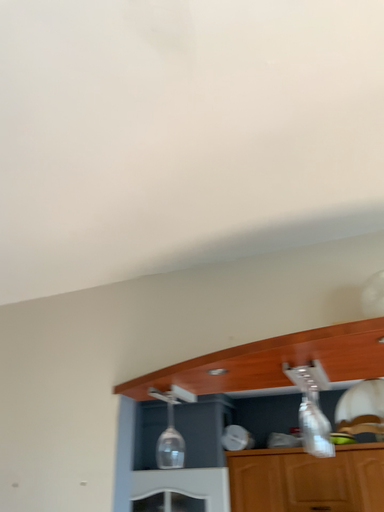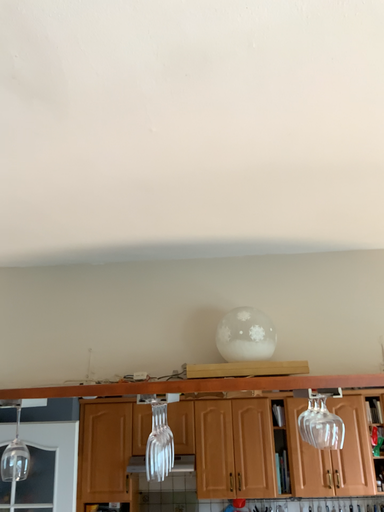
Question: How did the camera likely rotate when shooting the video?

Choices:
 (A) rotated upward
 (B) rotated downward

Answer: (B)